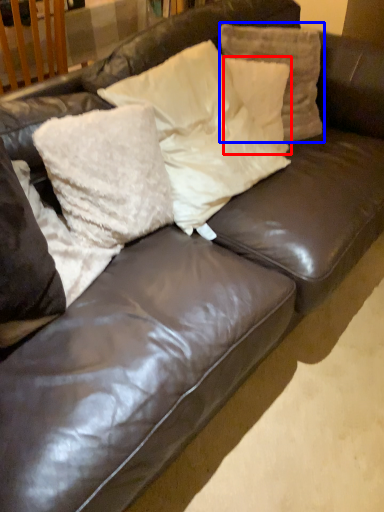
Question: Which point is closer to the camera, pillow (highlighted by a red box) or pillow (highlighted by a blue box)?

Choices:
 (A) pillow
 (B) pillow

Answer: (B)